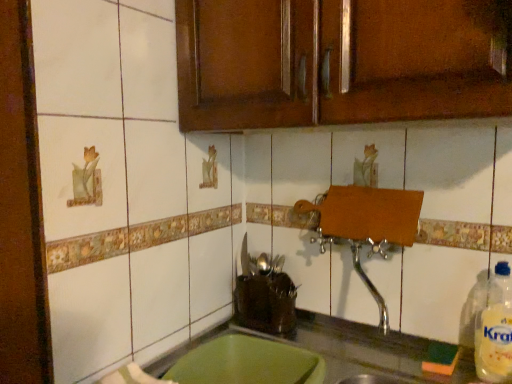
Question: Considering the relative sizes of green plastic tray at lower center and clear plastic bottle at right in the image provided, is green plastic tray at lower center wider than clear plastic bottle at right?

Choices:
 (A) no
 (B) yes

Answer: (B)

Question: From the image's perspective, is green plastic tray at lower center beneath clear plastic bottle at right?

Choices:
 (A) yes
 (B) no

Answer: (A)

Question: Is green plastic tray at lower center touching clear plastic bottle at right?

Choices:
 (A) yes
 (B) no

Answer: (B)

Question: Would you say green plastic tray at lower center is outside clear plastic bottle at right?

Choices:
 (A) no
 (B) yes

Answer: (B)

Question: Are green plastic tray at lower center and clear plastic bottle at right far apart?

Choices:
 (A) no
 (B) yes

Answer: (A)

Question: From the image's perspective, is green plastic tray at lower center above or below clear plastic bottle at right?

Choices:
 (A) above
 (B) below

Answer: (B)

Question: Is green plastic tray at lower center inside or outside of clear plastic bottle at right?

Choices:
 (A) outside
 (B) inside

Answer: (A)

Question: Is green plastic tray at lower center wider or thinner than clear plastic bottle at right?

Choices:
 (A) wide
 (B) thin

Answer: (A)

Question: From a real-world perspective, is green plastic tray at lower center positioned above or below clear plastic bottle at right?

Choices:
 (A) above
 (B) below

Answer: (B)

Question: Is clear plastic bottle at right inside the boundaries of brown wood cabinet at upper center, or outside?

Choices:
 (A) inside
 (B) outside

Answer: (B)

Question: Is clear plastic bottle at right taller or shorter than brown wood cabinet at upper center?

Choices:
 (A) short
 (B) tall

Answer: (A)

Question: From the image's perspective, is clear plastic bottle at right above or below brown wood cabinet at upper center?

Choices:
 (A) below
 (B) above

Answer: (A)

Question: In terms of size, does clear plastic bottle at right appear bigger or smaller than brown wood cabinet at upper center?

Choices:
 (A) small
 (B) big

Answer: (A)

Question: Is brown wood cabinet at upper center wider or thinner than clear plastic bottle at right?

Choices:
 (A) wide
 (B) thin

Answer: (A)

Question: Is point (206, 117) closer or farther from the camera than point (484, 344)?

Choices:
 (A) farther
 (B) closer

Answer: (A)